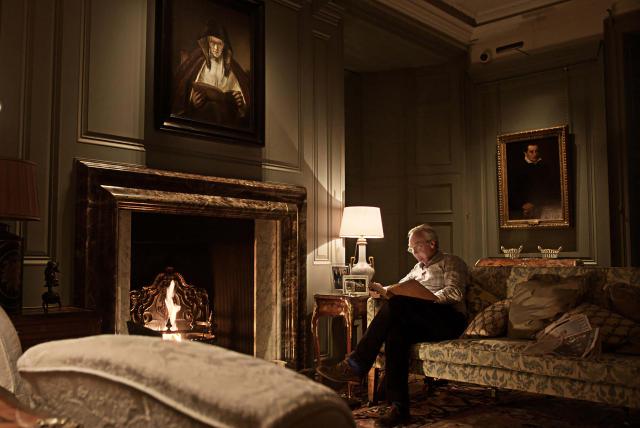
Identify the location of chair. (262, 392), (1, 335).